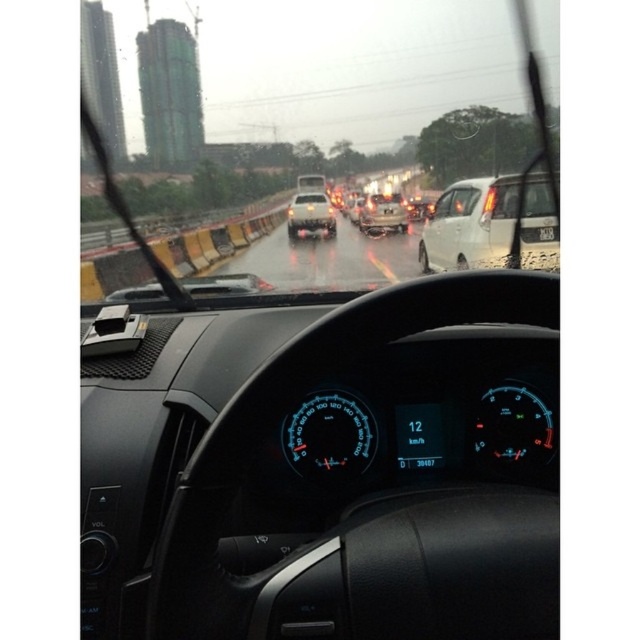
Can you confirm if blue illuminated speedometer at center is positioned to the right of metallic silver suv at center?

No, blue illuminated speedometer at center is not to the right of metallic silver suv at center.

Does point (317, 472) come farther from viewer compared to point (364, 196)?

No, (317, 472) is in front of (364, 196).

Where is `blue illuminated speedometer at center`? The image size is (640, 640). blue illuminated speedometer at center is located at coordinates (330, 436).

Who is positioned more to the left, white matte car at center or metallic silver sedan at center?

metallic silver sedan at center

Based on the photo, who is more distant from viewer, [483,260] or [285,225]?

Positioned behind is point [285,225].

This screenshot has width=640, height=640. In order to click on white matte car at center in this screenshot , I will do `click(470, 225)`.

Measure the distance between metallic silver sedan at center and metallic silver suv at center.

metallic silver sedan at center and metallic silver suv at center are 43.94 centimeters apart.

The image size is (640, 640). What do you see at coordinates (310, 212) in the screenshot?
I see `metallic silver sedan at center` at bounding box center [310, 212].

This screenshot has width=640, height=640. In order to click on metallic silver sedan at center in this screenshot , I will do `click(310, 212)`.